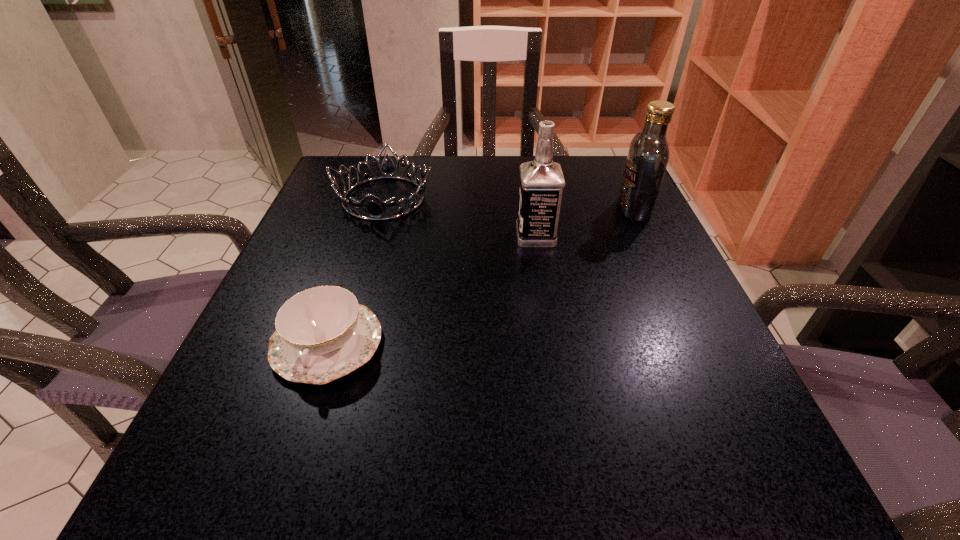
The width and height of the screenshot is (960, 540). In order to click on free space between the nearest object and the rightmost object in this screenshot , I will do `click(481, 276)`.

Where is `unoccupied area between the rightmost object and the nearest object`? Image resolution: width=960 pixels, height=540 pixels. unoccupied area between the rightmost object and the nearest object is located at coordinates (481, 276).

Where is `free space between the nearer vodka and the tiara`? The width and height of the screenshot is (960, 540). free space between the nearer vodka and the tiara is located at coordinates click(x=460, y=217).

Image resolution: width=960 pixels, height=540 pixels. I want to click on vacant area that lies between the tiara and the shortest object, so click(355, 271).

At what (x,y) coordinates should I click in order to perform the action: click on free space that is in between the nearer vodka and the tiara. Please return your answer as a coordinate pair (x, y). Looking at the image, I should click on (460, 217).

Locate an element on the screen. free spot between the tiara and the shortest object is located at coordinates (355, 271).

The width and height of the screenshot is (960, 540). What are the coordinates of `free point between the shortest object and the tiara` in the screenshot? It's located at (355, 271).

The height and width of the screenshot is (540, 960). I want to click on vacant space that's between the left vodka and the tiara, so click(460, 217).

Where is `object that ranks as the third closest to the third object from left to right`? object that ranks as the third closest to the third object from left to right is located at coordinates (322, 333).

Identify which object is the nearest to the chinaware. Please provide its 2D coordinates. Your answer should be formatted as a tuple, i.e. [(x, y)], where the tuple contains the x and y coordinates of a point satisfying the conditions above.

[(376, 213)]